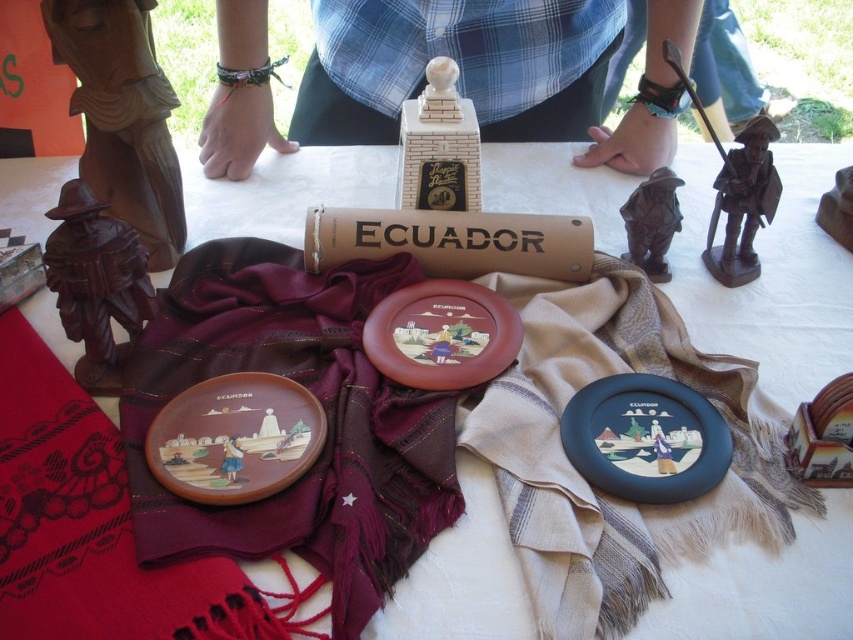
Looking at this image, you are organizing the Ecuadorian souvenir display and want to ensure the red woven blanket at lower left is visible. Since it is currently positioned behind the beige woven blanket at center, what adjustment should you make?

To make the red woven blanket at lower left visible, you should move it in front of the beige woven blanket at center since it is currently placed behind it.

You are looking at the Ecuadorian souvenir display. There are two points marked on the table. The first point is at coordinates point (177, 372) and the second is at point (57, 259). Which point is closer to you?

Point (177, 372) is further to the viewer than point (57, 259), so the second point is closer to you.

You are a delivery person who needs to place a small package between the matte black platter at center and the brown wood carving at left. The package is 15 inches long. Will it fit between them without overlapping either object?

The distance between the matte black platter at center and the brown wood carving at left is 15.26 inches. Since the package is 15 inches long, it will fit between them with a small gap of 0.26 inches remaining.